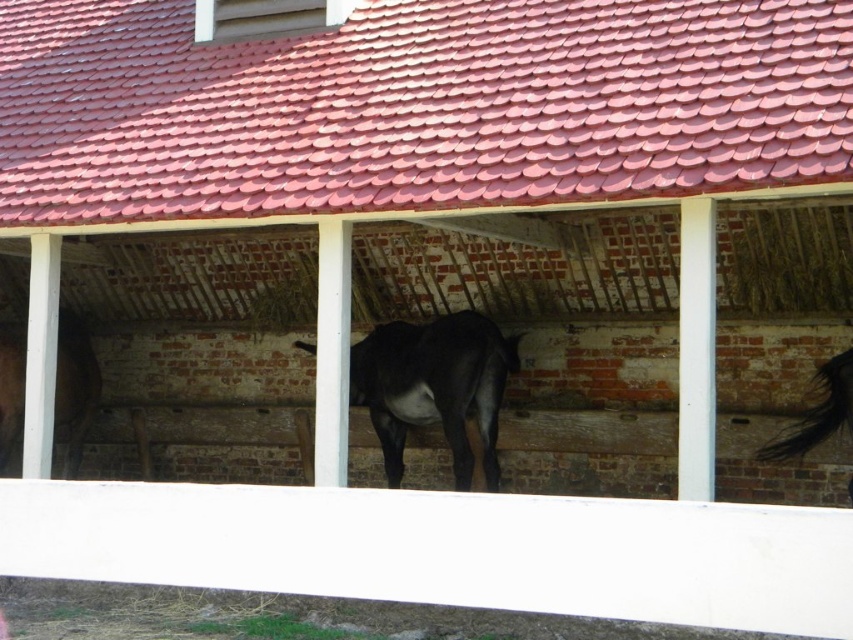
Question: Considering the real-world distances, which object is farthest from the black glossy horse at right?

Choices:
 (A) black glossy horse at center
 (B) dark brown glossy horse at left

Answer: (B)

Question: Is black glossy horse at center to the right of dark brown glossy horse at left from the viewer's perspective?

Choices:
 (A) yes
 (B) no

Answer: (A)

Question: Which point is farther to the camera?

Choices:
 (A) (809, 445)
 (B) (488, 371)

Answer: (B)

Question: Where is dark brown glossy horse at left located in relation to black glossy horse at right in the image?

Choices:
 (A) right
 (B) left

Answer: (B)

Question: Which is farther from the black glossy horse at center?

Choices:
 (A) dark brown glossy horse at left
 (B) black glossy horse at right

Answer: (A)

Question: Where is black glossy horse at center located in relation to dark brown glossy horse at left in the image?

Choices:
 (A) left
 (B) right

Answer: (B)